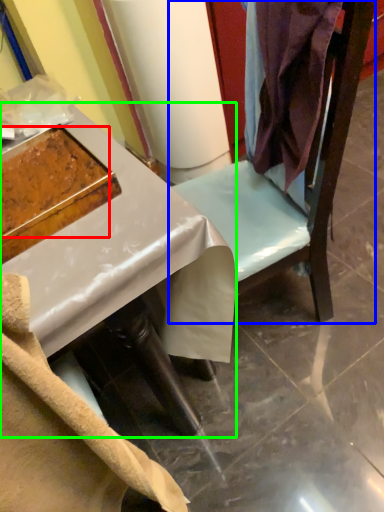
Question: Based on their relative distances, which object is nearer to food (highlighted by a red box)? Choose from furniture (highlighted by a blue box) and desk (highlighted by a green box).

Choices:
 (A) furniture
 (B) desk

Answer: (B)